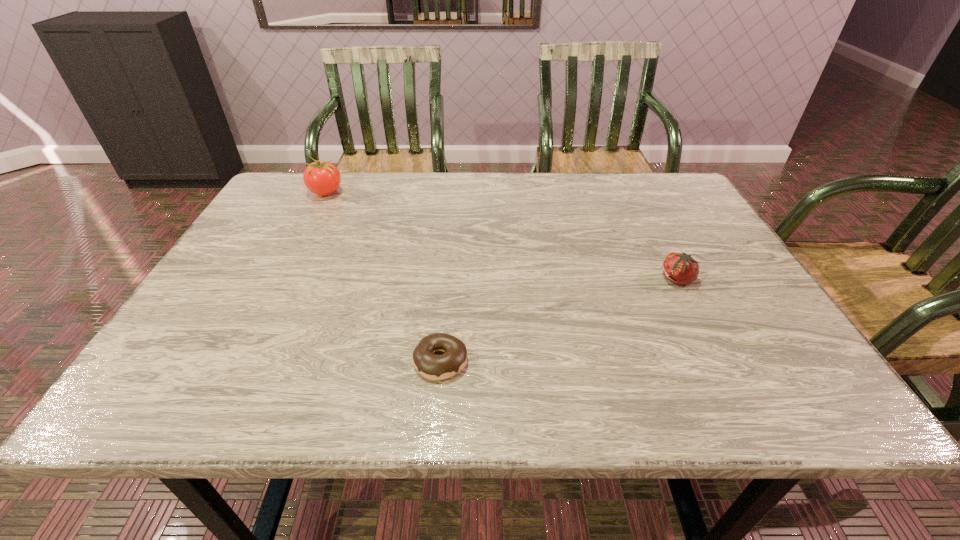
At what (x,y) coordinates should I click in order to perform the action: click on object that stands as the closest to the nearer tomato. Please return your answer as a coordinate pair (x, y). Looking at the image, I should click on (433, 367).

Identify which object is the nearest to the second farthest object. Please provide its 2D coordinates. Your answer should be formatted as a tuple, i.e. [(x, y)], where the tuple contains the x and y coordinates of a point satisfying the conditions above.

[(433, 367)]